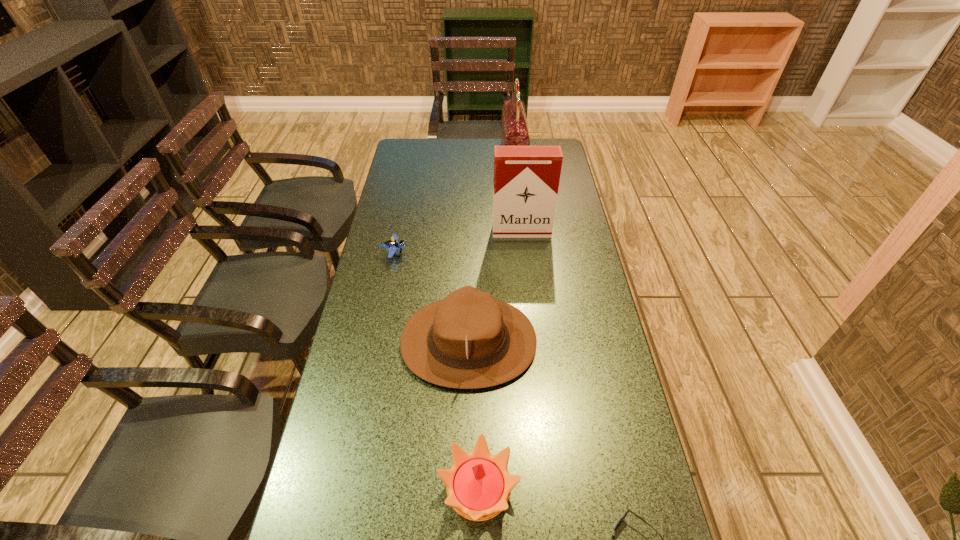
The image size is (960, 540). In order to click on vacant area situated 0.240m on the front-facing side of the cigarette_case in this screenshot , I will do `click(527, 285)`.

Locate an element on the screen. The width and height of the screenshot is (960, 540). vacant space situated 0.150m on the feather side of the third tallest object is located at coordinates (588, 342).

This screenshot has height=540, width=960. Find the location of `vacant space located on the right of the crown`. vacant space located on the right of the crown is located at coordinates (564, 489).

You are a GUI agent. You are given a task and a screenshot of the screen. Output one action in this format:
    pyautogui.click(x=<x>, y=<y>)
    Task: Click on the free spot located on the front-facing side of the leftmost object
    The image size is (960, 540).
    Given the screenshot: What is the action you would take?
    [503, 253]

At what (x,y) coordinates should I click in order to perform the action: click on object located in the far edge section of the desktop. Please return your answer as a coordinate pair (x, y). Looking at the image, I should click on (514, 131).

What are the coordinates of `fedora positioned at the left edge` in the screenshot? It's located at (469, 340).

Locate an element on the screen. Lego situated at the left edge is located at coordinates (392, 245).

Identify the location of object at the right edge. The image size is (960, 540). (526, 178).

This screenshot has height=540, width=960. Find the location of `free spot at the far edge of the desktop`. free spot at the far edge of the desktop is located at coordinates (460, 162).

Locate an element on the screen. free space at the left edge of the desktop is located at coordinates (369, 265).